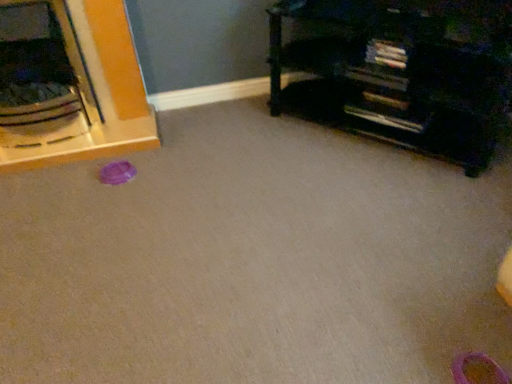
Question: From a real-world perspective, is black matte bookshelf at upper right, the 2th furniture when ordered from left to right, over brushed metal bowl at left, the second furniture viewed from the right?

Choices:
 (A) no
 (B) yes

Answer: (A)

Question: From the image's perspective, is black matte bookshelf at upper right, the 1th furniture positioned from the right, located beneath brushed metal bowl at left, which appears as the first furniture when viewed from the left?

Choices:
 (A) no
 (B) yes

Answer: (B)

Question: Is brushed metal bowl at left, the second furniture viewed from the right, inside black matte bookshelf at upper right, the 2th furniture when ordered from left to right?

Choices:
 (A) yes
 (B) no

Answer: (B)

Question: Is black matte bookshelf at upper right, the 2th furniture when ordered from left to right, oriented towards brushed metal bowl at left, which appears as the first furniture when viewed from the left?

Choices:
 (A) yes
 (B) no

Answer: (B)

Question: Considering the relative sizes of black matte bookshelf at upper right, the 2th furniture when ordered from left to right, and brushed metal bowl at left, which appears as the first furniture when viewed from the left, in the image provided, is black matte bookshelf at upper right, the 2th furniture when ordered from left to right, wider than brushed metal bowl at left, which appears as the first furniture when viewed from the left,?

Choices:
 (A) yes
 (B) no

Answer: (B)

Question: From the image's perspective, is pink rubber shoe at lower right above or below brushed metal bowl at left, which appears as the first furniture when viewed from the left?

Choices:
 (A) above
 (B) below

Answer: (B)

Question: Relative to brushed metal bowl at left, the second furniture viewed from the right, is pink rubber shoe at lower right in front or behind?

Choices:
 (A) behind
 (B) front

Answer: (B)

Question: Considering the positions of pink rubber shoe at lower right and brushed metal bowl at left, the second furniture viewed from the right, in the image, is pink rubber shoe at lower right bigger or smaller than brushed metal bowl at left, the second furniture viewed from the right,?

Choices:
 (A) small
 (B) big

Answer: (A)

Question: Would you say pink rubber shoe at lower right is to the left or to the right of brushed metal bowl at left, which appears as the first furniture when viewed from the left, in the picture?

Choices:
 (A) left
 (B) right

Answer: (B)

Question: In terms of width, does brushed metal bowl at left, which appears as the first furniture when viewed from the left, look wider or thinner when compared to black matte bookshelf at upper right, the 2th furniture when ordered from left to right?

Choices:
 (A) thin
 (B) wide

Answer: (B)

Question: In terms of height, does brushed metal bowl at left, the second furniture viewed from the right, look taller or shorter compared to black matte bookshelf at upper right, the 2th furniture when ordered from left to right?

Choices:
 (A) short
 (B) tall

Answer: (B)

Question: Is brushed metal bowl at left, the second furniture viewed from the right, to the left or to the right of black matte bookshelf at upper right, the 2th furniture when ordered from left to right, in the image?

Choices:
 (A) right
 (B) left

Answer: (B)

Question: Choose the correct answer: Is brushed metal bowl at left, which appears as the first furniture when viewed from the left, inside black matte bookshelf at upper right, the 2th furniture when ordered from left to right, or outside it?

Choices:
 (A) inside
 (B) outside

Answer: (B)

Question: Considering the positions of black matte bookshelf at upper right, the 2th furniture when ordered from left to right, and pink rubber shoe at lower right in the image, is black matte bookshelf at upper right, the 2th furniture when ordered from left to right, taller or shorter than pink rubber shoe at lower right?

Choices:
 (A) short
 (B) tall

Answer: (B)

Question: From the image's perspective, is black matte bookshelf at upper right, the 1th furniture positioned from the right, above or below pink rubber shoe at lower right?

Choices:
 (A) below
 (B) above

Answer: (B)